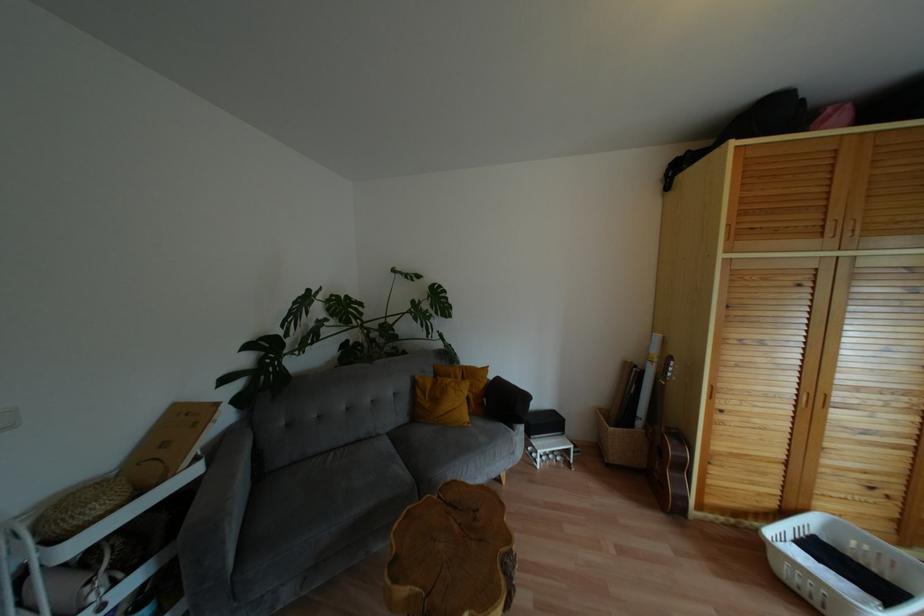
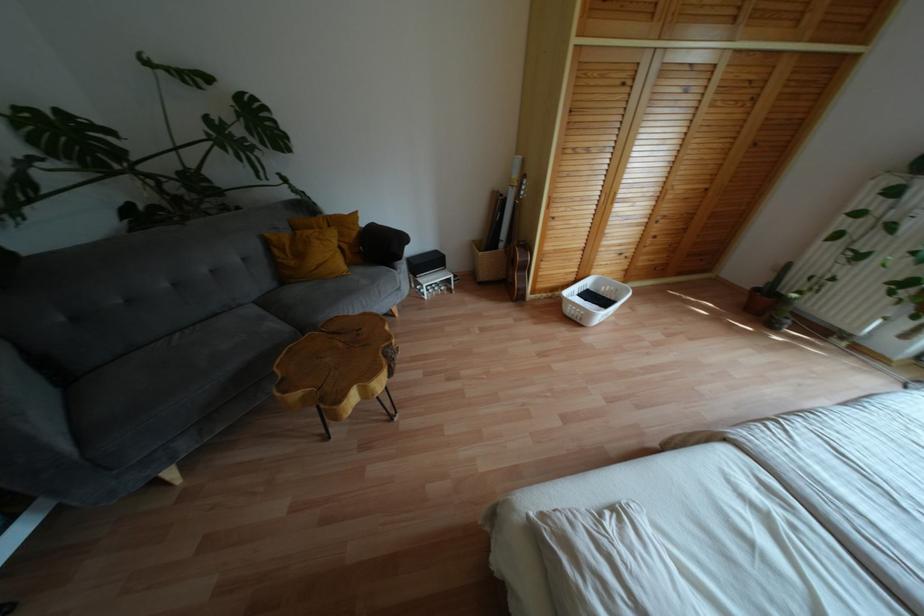
The point at [456,525] is marked in the first image. Where is the corresponding point in the second image?

(341, 344)